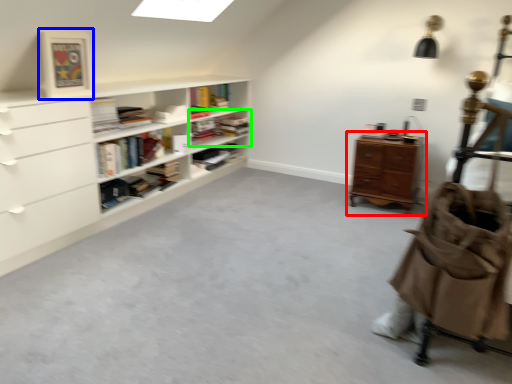
Question: Based on their relative distances, which object is nearer to chest of drawers (highlighted by a red box)? Choose from picture frame (highlighted by a blue box) and shelf (highlighted by a green box).

Choices:
 (A) picture frame
 (B) shelf

Answer: (B)